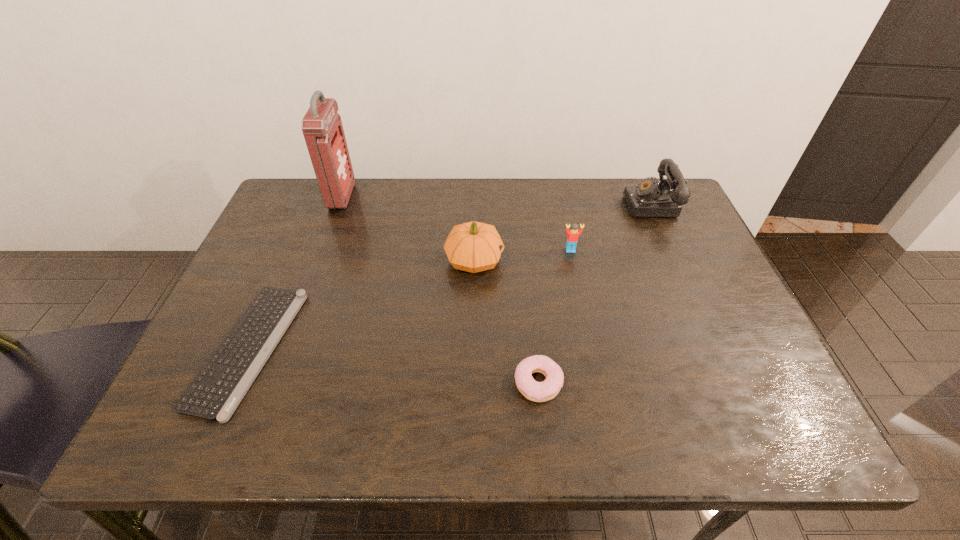
At what (x,y) coordinates should I click in order to perform the action: click on vacant space located 0.380m on the dial of the telephone. Please return your answer as a coordinate pair (x, y). Image resolution: width=960 pixels, height=540 pixels. Looking at the image, I should click on (500, 204).

Where is `vacant space located 0.260m on the dial of the telephone`? vacant space located 0.260m on the dial of the telephone is located at coordinates (540, 204).

The height and width of the screenshot is (540, 960). What are the coordinates of `vacant area situated on the side of the gourd with the carved face` in the screenshot? It's located at (606, 260).

Locate an element on the screen. Image resolution: width=960 pixels, height=540 pixels. vacant space located 0.150m on the face of the second object from right to left is located at coordinates (580, 294).

Identify the location of free space located on the right of the fourth object from left to right. (726, 383).

I want to click on vacant region located 0.160m on the right of the shortest object, so click(362, 348).

Where is `the first-aid kit located at the far edge`? the first-aid kit located at the far edge is located at coordinates (322, 128).

I want to click on telephone that is at the far edge, so click(x=649, y=198).

Identify the location of doughnut that is at the near edge. The image size is (960, 540). (534, 391).

Locate an element on the screen. The image size is (960, 540). computer keyboard that is positioned at the near edge is located at coordinates (217, 390).